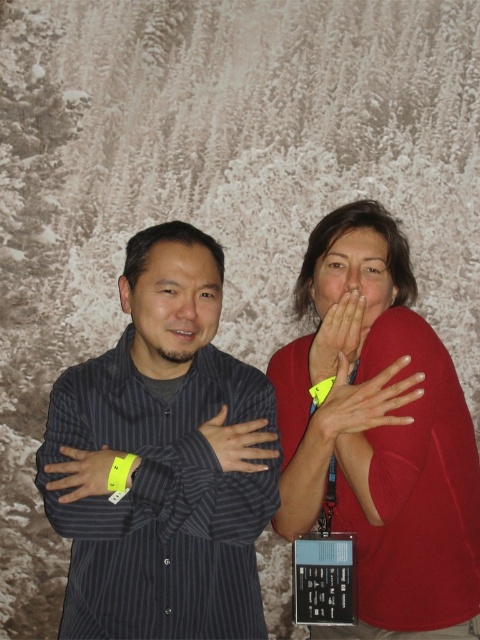
Question: Estimate the real-world distances between objects in this image. Which object is closer to the yellow fabric wristband at center?

Choices:
 (A) yellow fabric wristband at left
 (B) matte red sweater at right

Answer: (B)

Question: Can you confirm if dark gray striped shirt at center is bigger than yellow fabric wristband at center?

Choices:
 (A) no
 (B) yes

Answer: (B)

Question: Which point is closer to the camera?

Choices:
 (A) (197, 324)
 (B) (367, 314)
 (C) (243, 429)

Answer: (C)

Question: Is matte red sweater at right below yellow fabric wristband at left?

Choices:
 (A) no
 (B) yes

Answer: (A)

Question: Is matte black face at center wider than yellow fabric hand at center?

Choices:
 (A) no
 (B) yes

Answer: (B)

Question: Which point is closer to the camera?

Choices:
 (A) matte black hand at center
 (B) matte black face at center

Answer: (A)